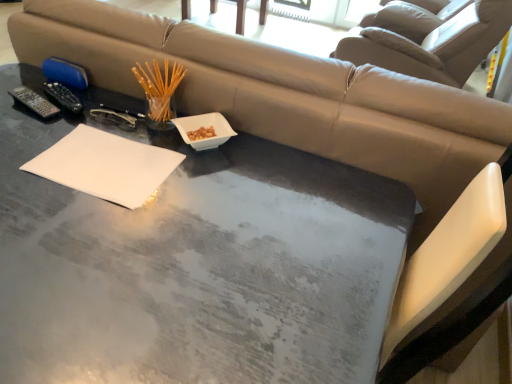
Where is `free space on the front side of white matte notepad at center`? free space on the front side of white matte notepad at center is located at coordinates (84, 236).